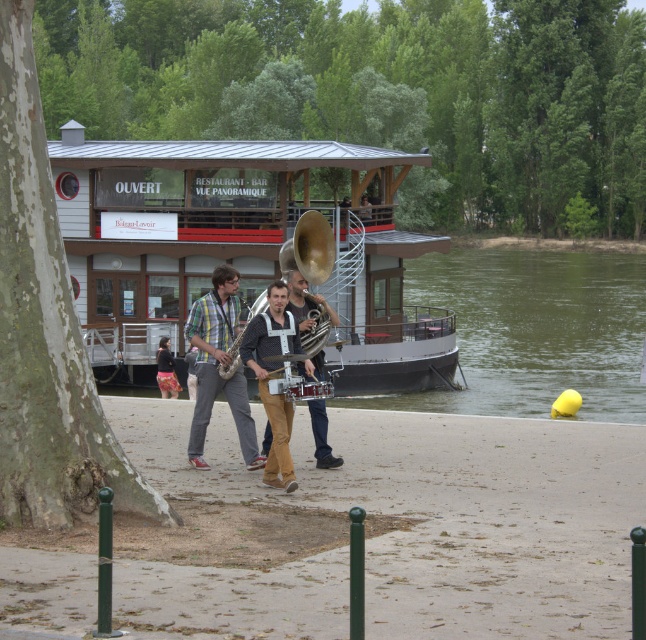
You are a photographer trying to capture the musicians in the scene. You notice a point at coordinates (x=216, y=365) on the plaid fabric shirt at center. If you want to focus on the plaid fabric shirt at center, should you adjust your camera to zoom in or out from that point?

The point at (x=216, y=365) is already on the plaid fabric shirt at center, so you do not need to adjust the zoom. Keep the camera focused on that point to capture the plaid fabric shirt at center.

You are a photographer at the riverside scene. You want to capture a photo of the plaid fabric shirt at center and the floral skirt at center. Which clothing item should you zoom in on more to ensure both are clearly visible in the frame?

The plaid fabric shirt at center is smaller in size compared to the floral skirt at center, so you should zoom in more on the plaid fabric shirt at center to ensure both are clearly visible.